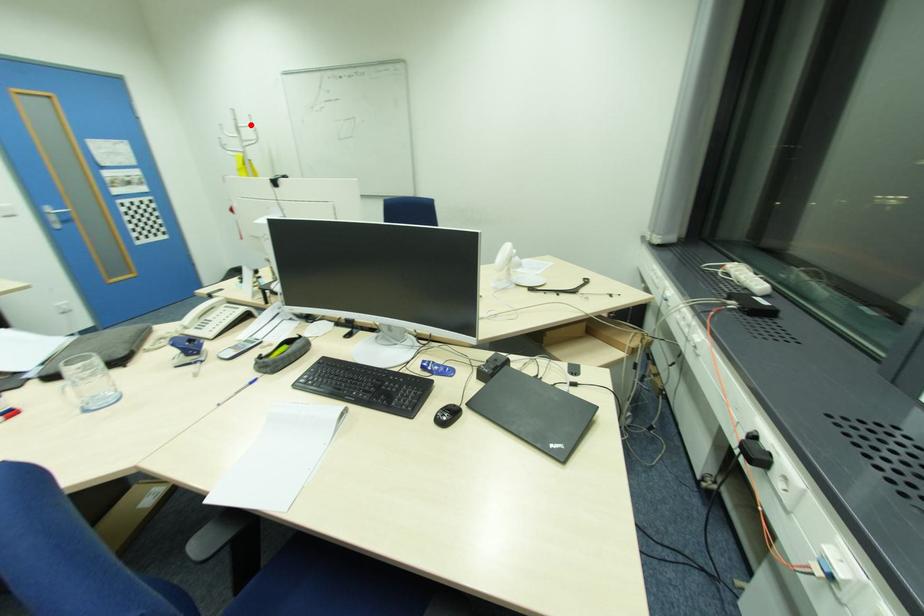
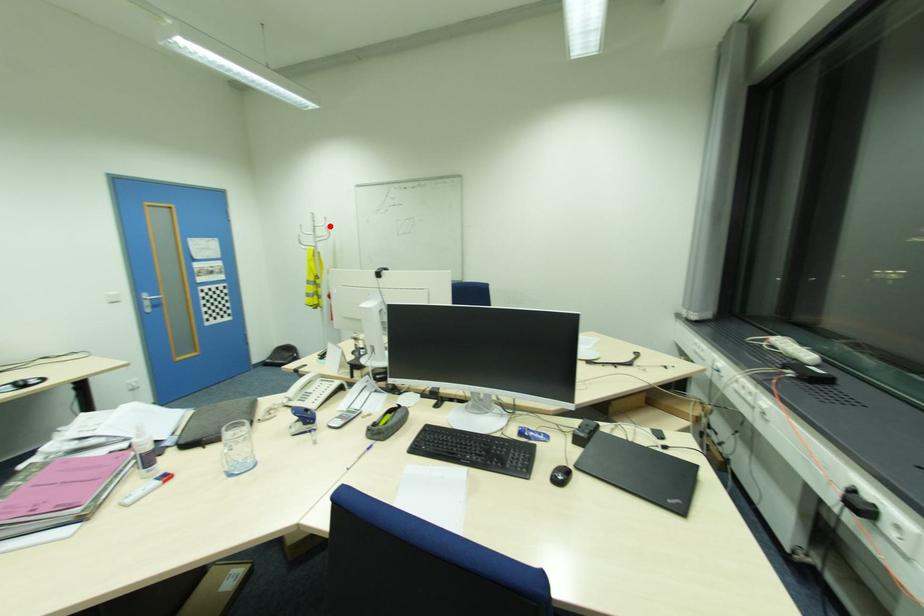
In the scene shown: I am providing you with two images of the same scene from different viewpoints. A red point is marked on the first image and another point is marked on the second image. Is the marked point in image1 the same physical position as the marked point in image2?

Yes